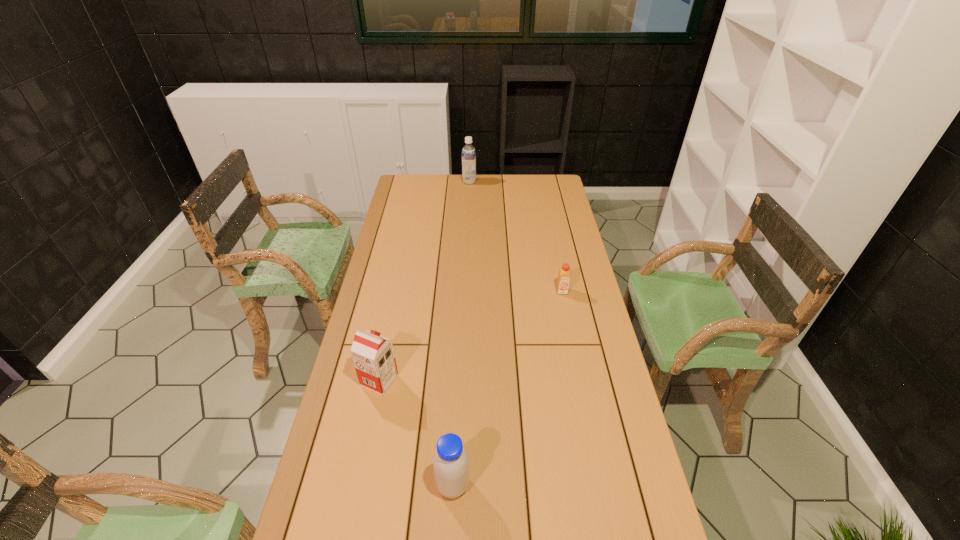
Locate an element on the screen. The image size is (960, 540). the closest soya milk to the third farthest object is located at coordinates (451, 464).

Locate an element on the screen. The width and height of the screenshot is (960, 540). vacant space that satisfies the following two spatial constraints: 1. on the label of the farthest soya milk; 2. on the front side of the nearest soya milk is located at coordinates point(458,485).

Identify the location of vacant position in the image that satisfies the following two spatial constraints: 1. on the front side of the second nearest object; 2. on the left side of the nearest object. The width and height of the screenshot is (960, 540). (358, 485).

You are a GUI agent. You are given a task and a screenshot of the screen. Output one action in this format:
    pyautogui.click(x=<x>, y=<y>)
    Task: Click on the vacant space that satisfies the following two spatial constraints: 1. on the front side of the third farthest object; 2. on the left side of the nearest soya milk
    This screenshot has width=960, height=540.
    Given the screenshot: What is the action you would take?
    pyautogui.click(x=358, y=485)